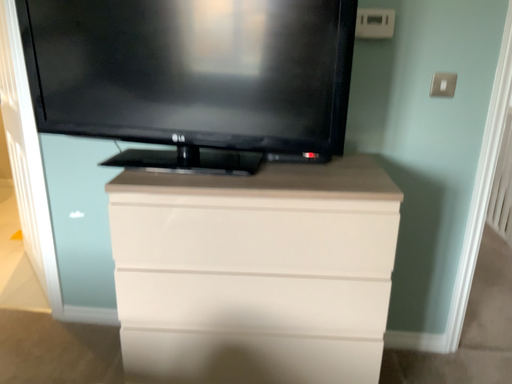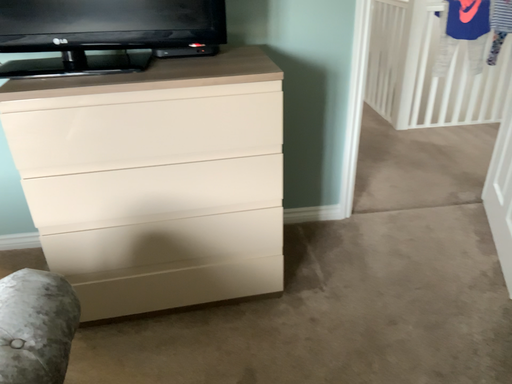
Question: How did the camera likely rotate when shooting the video?

Choices:
 (A) rotated right
 (B) rotated left

Answer: (A)